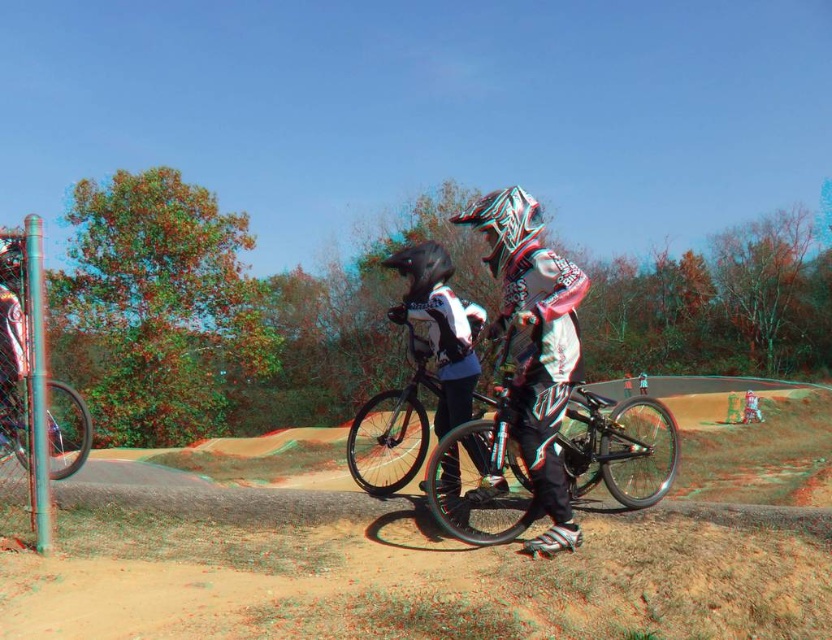
You are a photographer trying to capture both the shiny metallic helmet at center and the shiny black helmet at upper left in a single shot. Based on their positions, which helmet should you focus on first to ensure both are in frame?

The shiny metallic helmet at center is positioned on the right side of the shiny black helmet at upper left, so you should focus on the shiny black helmet at upper left first to ensure both are in frame.